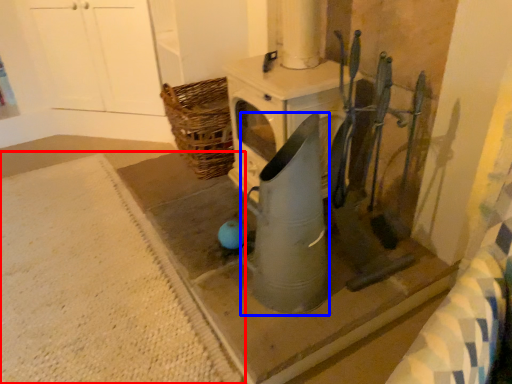
Question: Among these objects, which one is nearest to the camera, concrete (highlighted by a red box) or appliance (highlighted by a blue box)?

Choices:
 (A) concrete
 (B) appliance

Answer: (B)